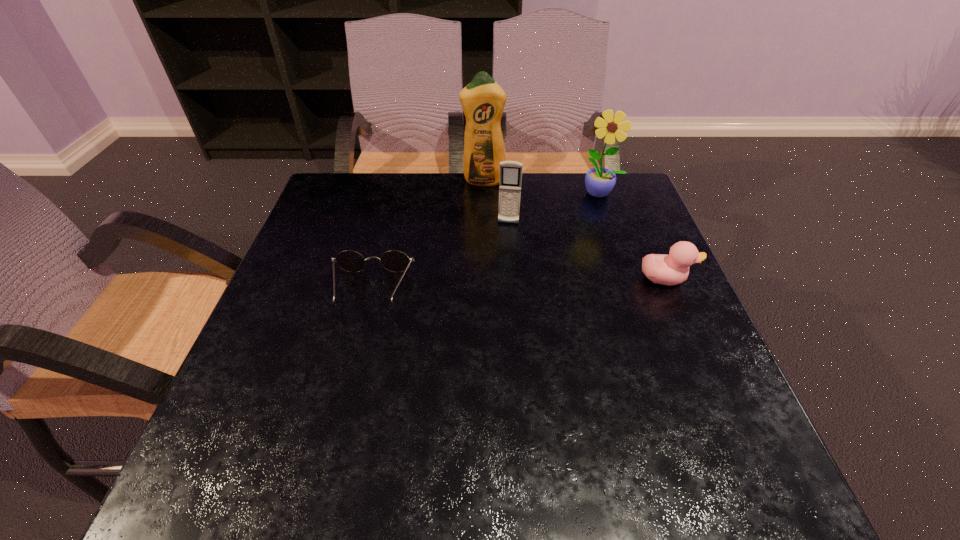
Identify the location of free space between the duckling and the detergent. [x=574, y=230].

Point out which object is positioned as the third nearest to the fourth shortest object. Please provide its 2D coordinates. Your answer should be formatted as a tuple, i.e. [(x, y)], where the tuple contains the x and y coordinates of a point satisfying the conditions above.

[(672, 269)]

Select which object appears as the third closest to the leftmost object. Please provide its 2D coordinates. Your answer should be formatted as a tuple, i.e. [(x, y)], where the tuple contains the x and y coordinates of a point satisfying the conditions above.

[(672, 269)]

The width and height of the screenshot is (960, 540). Find the location of `vacant space that satisfies the following two spatial constraints: 1. on the front side of the sunflower; 2. on the front-facing side of the duckling`. vacant space that satisfies the following two spatial constraints: 1. on the front side of the sunflower; 2. on the front-facing side of the duckling is located at coordinates (630, 279).